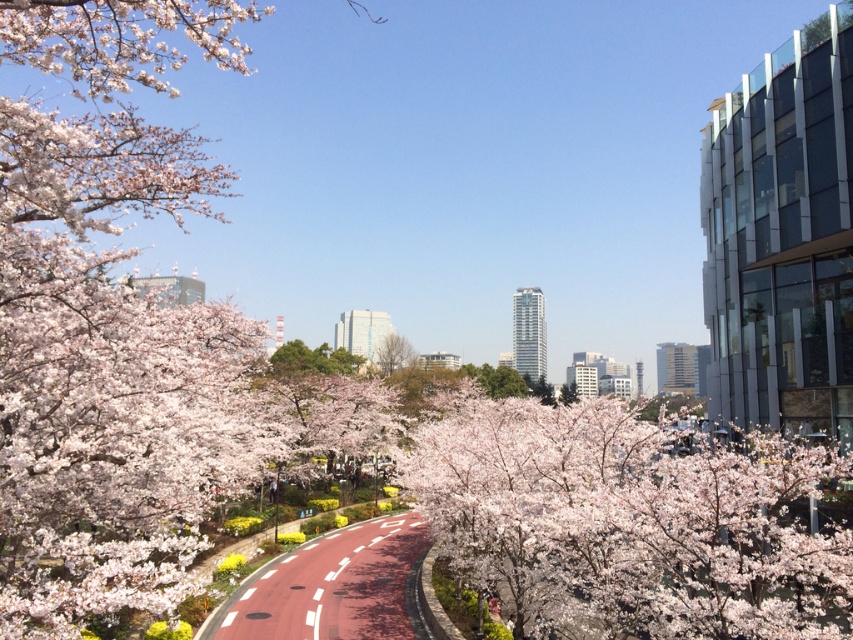
Question: Is pink blossoms at center below green leafy tree at center?

Choices:
 (A) no
 (B) yes

Answer: (B)

Question: Which object appears closest to the camera in this image?

Choices:
 (A) pink blossoms at center
 (B) green leafy tree at center

Answer: (A)

Question: Can you confirm if pink blossoms at center is bigger than green leafy tree at center?

Choices:
 (A) yes
 (B) no

Answer: (B)

Question: Which of the following is the farthest from the observer?

Choices:
 (A) green leafy tree at center
 (B) pink blossoms at center

Answer: (A)

Question: Can you confirm if pink blossoms at center is positioned to the left of green leafy tree at center?

Choices:
 (A) no
 (B) yes

Answer: (A)